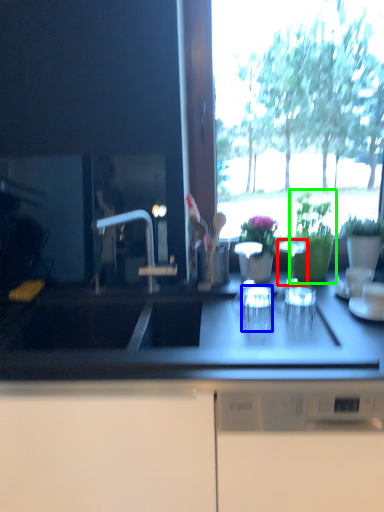
Question: Which object is positioned farthest from tableware (highlighted by a red box)? Select from tableware (highlighted by a blue box) and houseplant (highlighted by a green box).

Choices:
 (A) tableware
 (B) houseplant

Answer: (A)